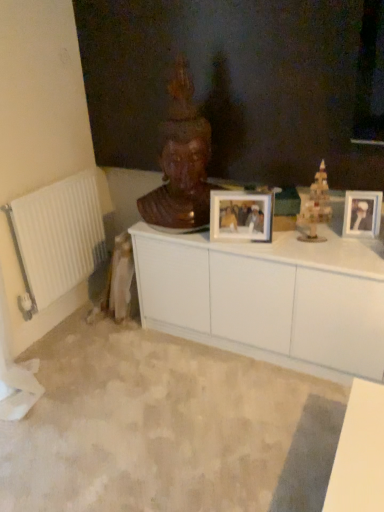
Question: Would you say wooden tower at upper right is outside white glossy picture frame at center, the first picture frame in the left-to-right sequence?

Choices:
 (A) no
 (B) yes

Answer: (B)

Question: Is white glossy picture frame at center, the first picture frame in the left-to-right sequence, a part of wooden tower at upper right?

Choices:
 (A) no
 (B) yes

Answer: (A)

Question: From a real-world perspective, is wooden tower at upper right physically below white glossy picture frame at center, the first picture frame in the left-to-right sequence?

Choices:
 (A) yes
 (B) no

Answer: (B)

Question: From the image's perspective, is wooden tower at upper right on white glossy picture frame at center, the first picture frame in the left-to-right sequence?

Choices:
 (A) no
 (B) yes

Answer: (B)

Question: Is wooden tower at upper right looking in the opposite direction of white glossy picture frame at center, acting as the second picture frame starting from the right?

Choices:
 (A) yes
 (B) no

Answer: (B)

Question: From the image's perspective, is wooden tower at upper right beneath white glossy picture frame at center, the first picture frame in the left-to-right sequence?

Choices:
 (A) no
 (B) yes

Answer: (A)

Question: Is wooden statue at center further to the viewer compared to white glossy picture frame at center, acting as the second picture frame starting from the right?

Choices:
 (A) yes
 (B) no

Answer: (B)

Question: From the image's perspective, is wooden statue at center over white glossy picture frame at center, acting as the second picture frame starting from the right?

Choices:
 (A) yes
 (B) no

Answer: (A)

Question: Does wooden statue at center have a greater height compared to white glossy picture frame at center, acting as the second picture frame starting from the right?

Choices:
 (A) yes
 (B) no

Answer: (A)

Question: Does wooden statue at center have a lesser width compared to white glossy picture frame at center, acting as the second picture frame starting from the right?

Choices:
 (A) yes
 (B) no

Answer: (B)

Question: Are wooden statue at center and white glossy picture frame at center, acting as the second picture frame starting from the right, far apart?

Choices:
 (A) yes
 (B) no

Answer: (B)

Question: Can we say wooden statue at center lies outside white glossy picture frame at center, the first picture frame in the left-to-right sequence?

Choices:
 (A) yes
 (B) no

Answer: (A)

Question: From a real-world perspective, is white glossy picture frame at center, acting as the second picture frame starting from the right, over wooden statue at center?

Choices:
 (A) no
 (B) yes

Answer: (A)